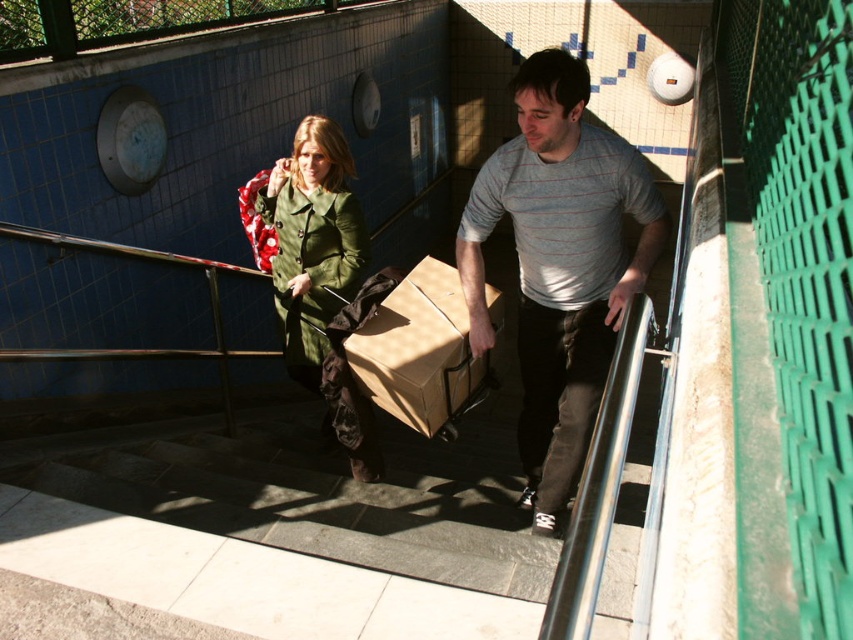
Question: Which point is farther to the camera?

Choices:
 (A) click(274, 300)
 (B) click(445, 426)
 (C) click(573, 432)

Answer: (A)

Question: Can you confirm if gray striped shirt at center is bigger than green matte coat at center?

Choices:
 (A) no
 (B) yes

Answer: (B)

Question: Is gray striped shirt at center to the left of green matte coat at center from the viewer's perspective?

Choices:
 (A) no
 (B) yes

Answer: (A)

Question: Which object appears farthest from the camera in this image?

Choices:
 (A) gray striped shirt at center
 (B) green matte coat at center

Answer: (B)

Question: Can you confirm if green matte coat at center is smaller than brown cardboard box at center?

Choices:
 (A) yes
 (B) no

Answer: (B)

Question: Which object is positioned farthest from the gray striped shirt at center?

Choices:
 (A) brown cardboard box at center
 (B) green matte coat at center

Answer: (B)